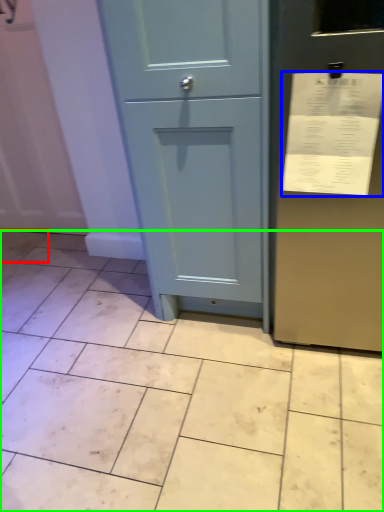
Question: Based on their relative distances, which object is farther from ceramic tile (highlighted by a red box)? Choose from receipt (highlighted by a blue box) and ceramic tile (highlighted by a green box).

Choices:
 (A) receipt
 (B) ceramic tile

Answer: (A)